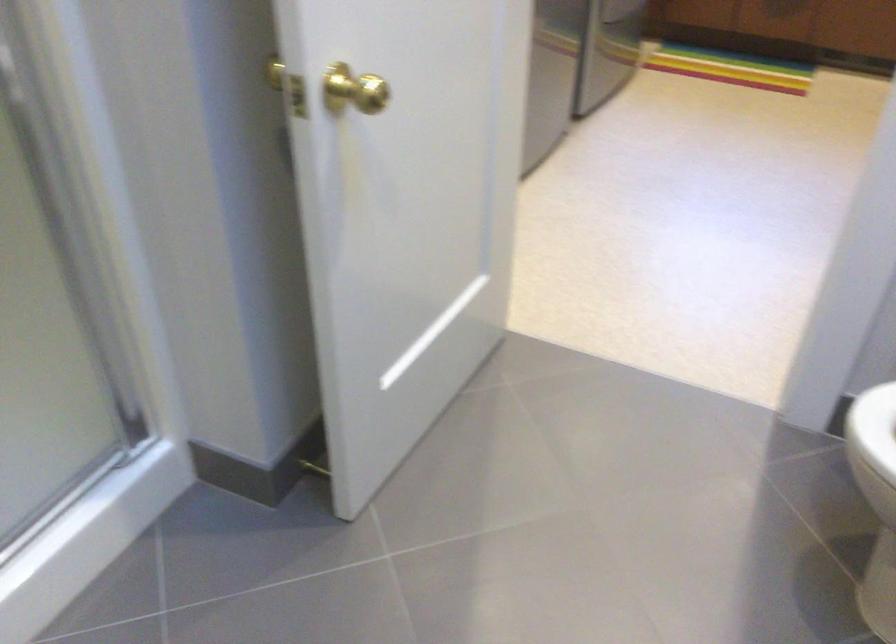
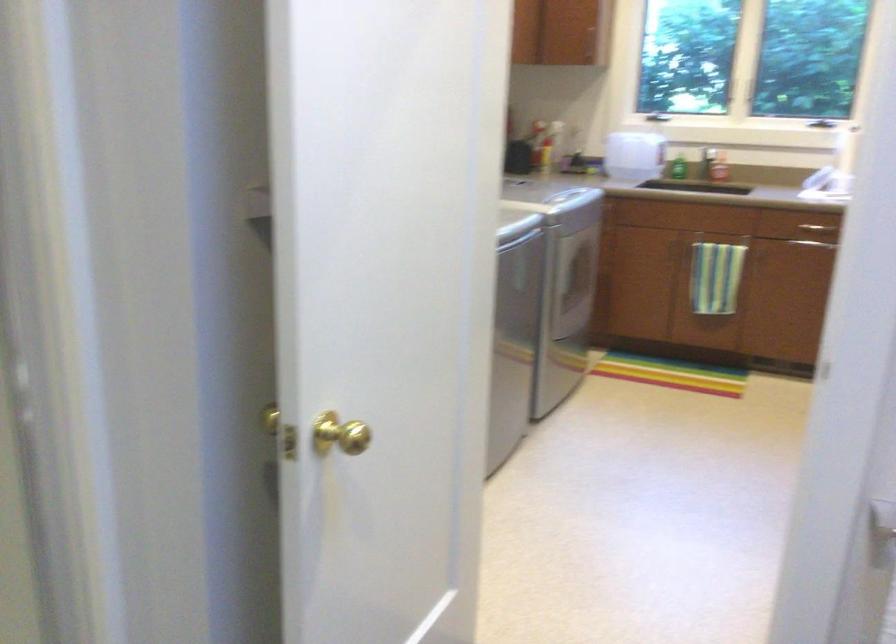
Question: The images are taken continuously from a first-person perspective. In which direction are you moving?

Choices:
 (A) Left
 (B) Right
 (C) Forward
 (D) Backward

Answer: (D)